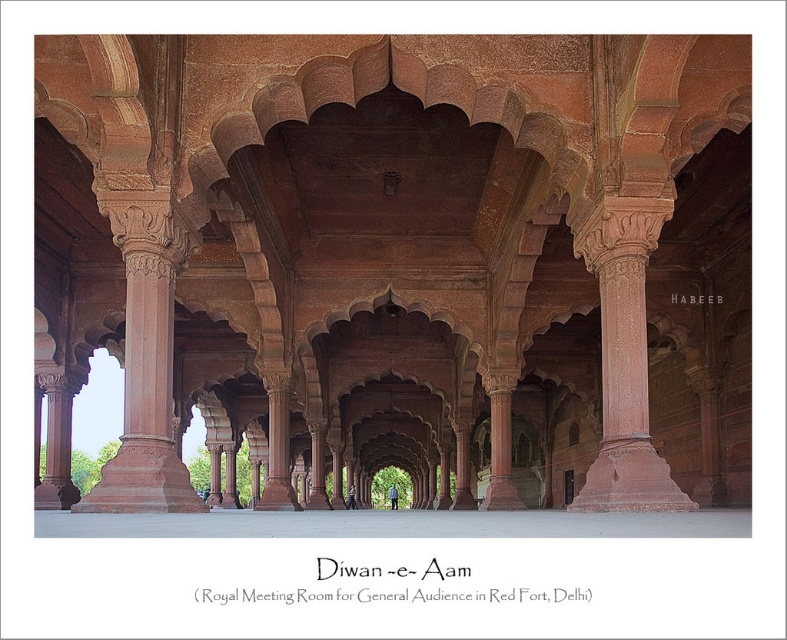
Based on the scene of the Diwan_e_Aam in the Red Fort, if you are standing at the entrance facing the structure, which object is positioned to the left of the other between the red sandstone arches at center and the rustic stone column at center?

The red sandstone arches at center are to the left of the rustic stone column at center.

Based on the scene of the Diwan_e_Aam at the Red Fort, which object is taller between the red sandstone arches at center and the rustic stone column at center?

The red sandstone arches at center are taller than the rustic stone column at center.